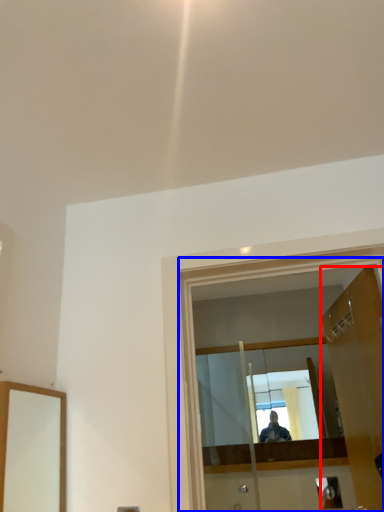
Question: Which point is closer to the camera, door (highlighted by a red box) or glass door (highlighted by a blue box)?

Choices:
 (A) door
 (B) glass door

Answer: (B)